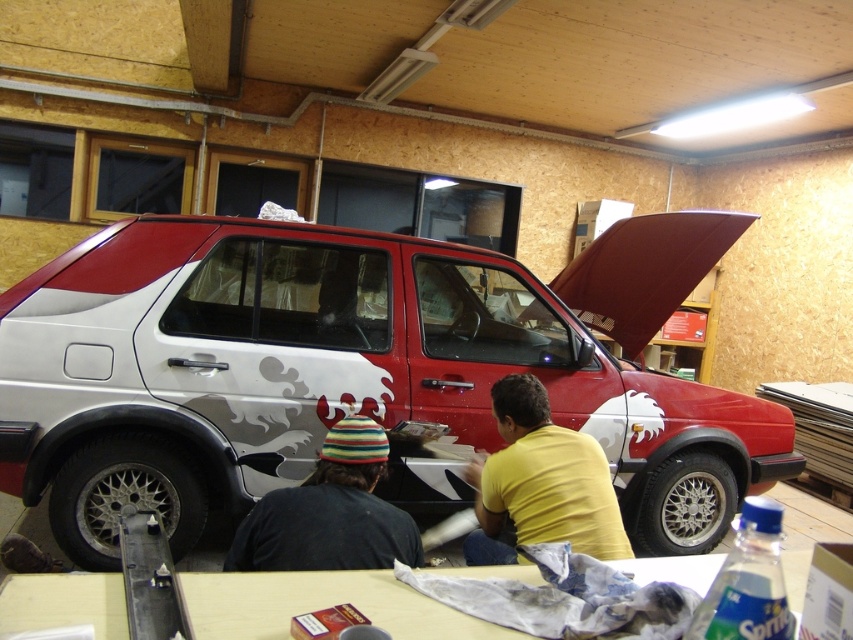
You are a mechanic who needs to move the wooden table at lower center to the other side of the metallic silver car at center. Given that the car is larger than the table, will the table fit behind the car without overlapping?

The metallic silver car at center is bigger than the wooden table at lower center. Since the car is larger, the table can fit behind it without overlapping as long as there is enough space in the workshop.

You are a mechanic in the workshop and need to place a tool on the wooden table at lower center. However, there is a striped knit hat at lower center on the table. Will the hat interfere with placing the tool?

The wooden table at lower center is not as tall as striped knit hat at lower center, meaning the hat is taller than the table. This suggests the hat might be standing upright or hanging over the edge, potentially obstructing the placement of the tool on the table.